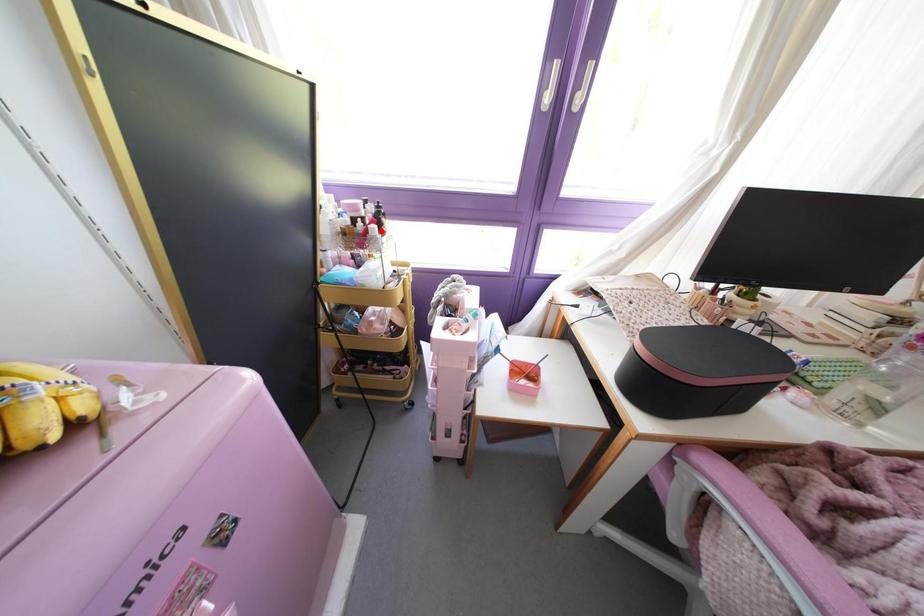
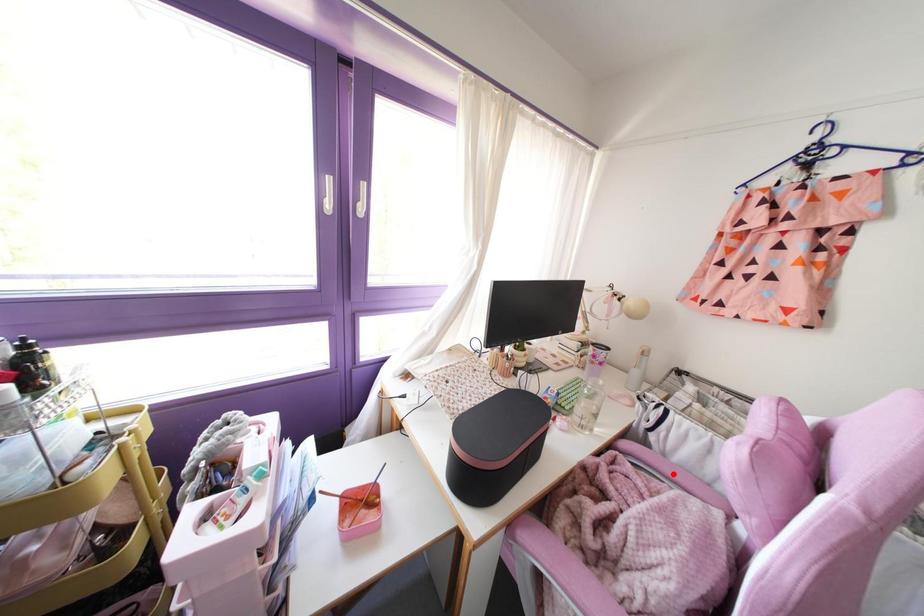
I am providing you with two images of the same scene from different viewpoints. A red point is marked on the first image and another point is marked on the second image. Does the point marked in image1 correspond to the same location as the one in image2?

No